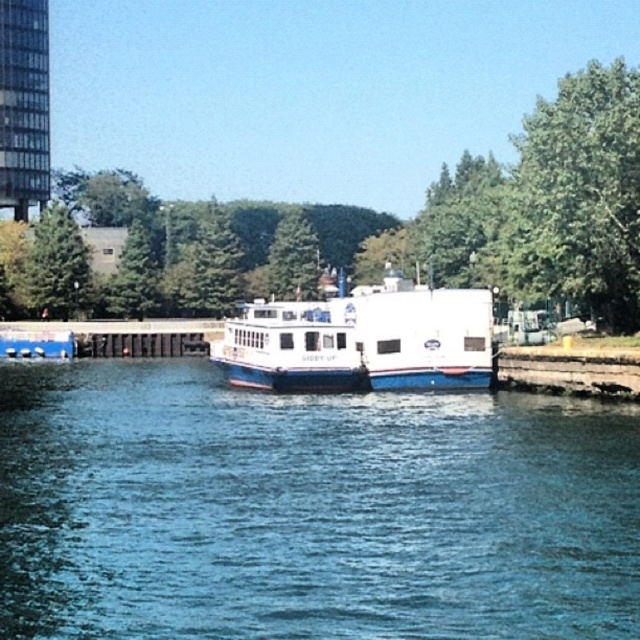
Question: Which point is farther to the camera?

Choices:
 (A) green leafy tree at upper right
 (B) blue glossy water at center
 (C) green matte tree at upper left
 (D) white matte boat at center

Answer: (C)

Question: Does green leafy tree at upper right have a smaller size compared to green matte tree at upper left?

Choices:
 (A) no
 (B) yes

Answer: (A)

Question: Which of these objects is positioned farthest from the green matte tree at upper left?

Choices:
 (A) white matte boat at center
 (B) green leafy tree at upper right
 (C) blue glossy water at center

Answer: (C)

Question: Does white matte boat at center come in front of green matte tree at upper left?

Choices:
 (A) no
 (B) yes

Answer: (B)

Question: Which object appears closest to the camera in this image?

Choices:
 (A) white matte boat at center
 (B) green leafy tree at upper right

Answer: (B)

Question: Does blue glossy water at center appear under green matte tree at upper left?

Choices:
 (A) yes
 (B) no

Answer: (A)